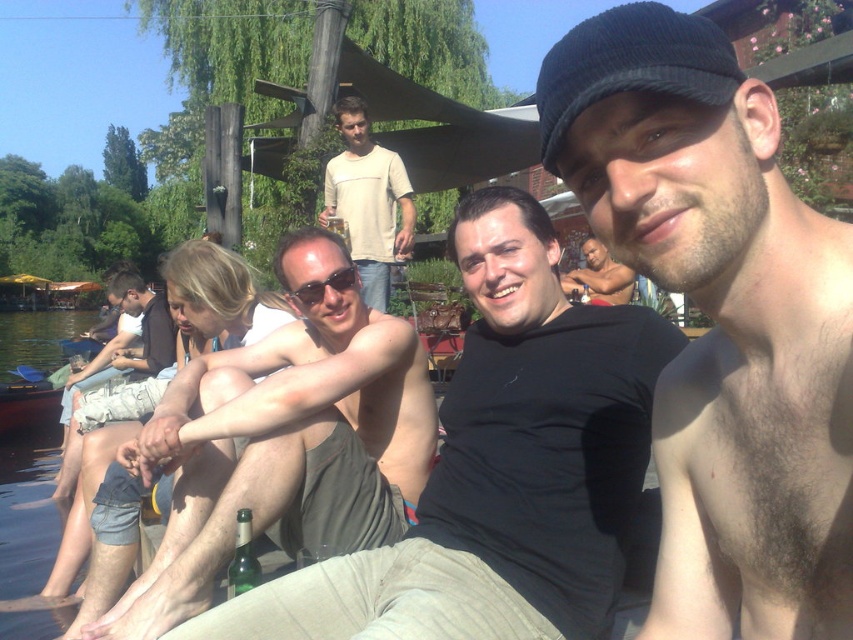
You are standing at the origin point of the image. Where is the tan skin shirtless man at center located in terms of coordinates?

The tan skin shirtless man at center is located at coordinates point (283, 442).

You are standing at the point labeled point (x=48, y=368) and want to move towards the point labeled point (x=401, y=248). Which direction should you move to get closer to it?

You should move upwards and to the left to get closer to point (x=401, y=248) since it is closer to the viewer than point (x=48, y=368).